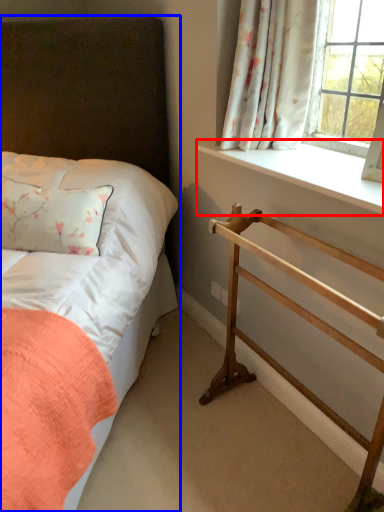
Question: Which object is closer to the camera taking this photo, window sill (highlighted by a red box) or bed (highlighted by a blue box)?

Choices:
 (A) window sill
 (B) bed

Answer: (B)